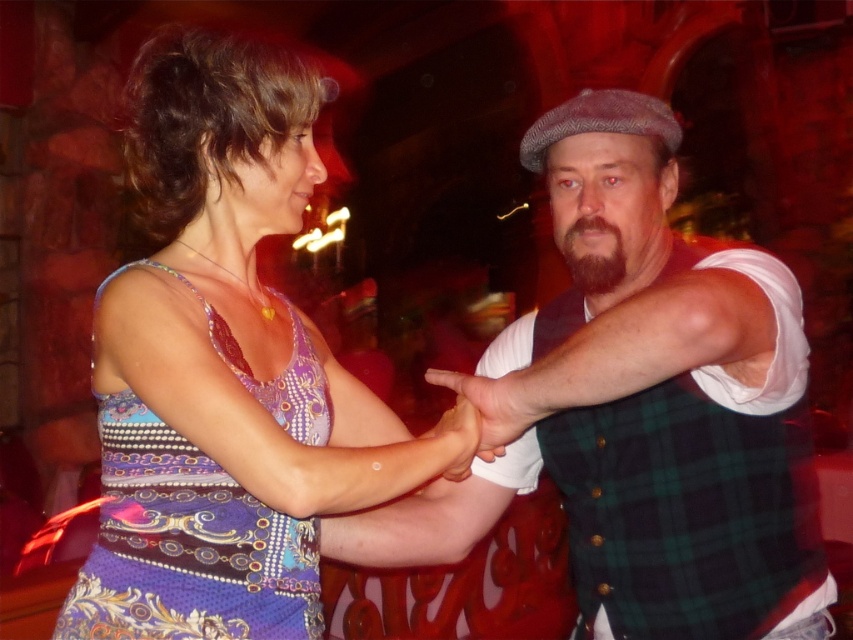
Which is in front, point (798, 444) or point (465, 385)?

Point (465, 385) is more forward.

Where is `green plaid vest at center`? green plaid vest at center is located at coordinates (646, 412).

Does green plaid vest at center lie behind patterned silk dress at center?

No, green plaid vest at center is closer to the viewer.

Can you confirm if green plaid vest at center is taller than patterned silk dress at center?

Indeed, green plaid vest at center has a greater height compared to patterned silk dress at center.

Measure the distance between point (573, 458) and camera.

1.33 meters

The image size is (853, 640). What are the coordinates of `green plaid vest at center` in the screenshot? It's located at (646, 412).

Who is more forward, (134, 468) or (585, 220)?

Point (134, 468) is in front.

Can you confirm if patterned silk dress at center is shorter than dark brown fuzzy beard at center?

No, patterned silk dress at center is not shorter than dark brown fuzzy beard at center.

Which is behind, point (198, 449) or point (599, 218)?

Point (599, 218)

This screenshot has height=640, width=853. Find the location of `patterned silk dress at center`. patterned silk dress at center is located at coordinates (186, 545).